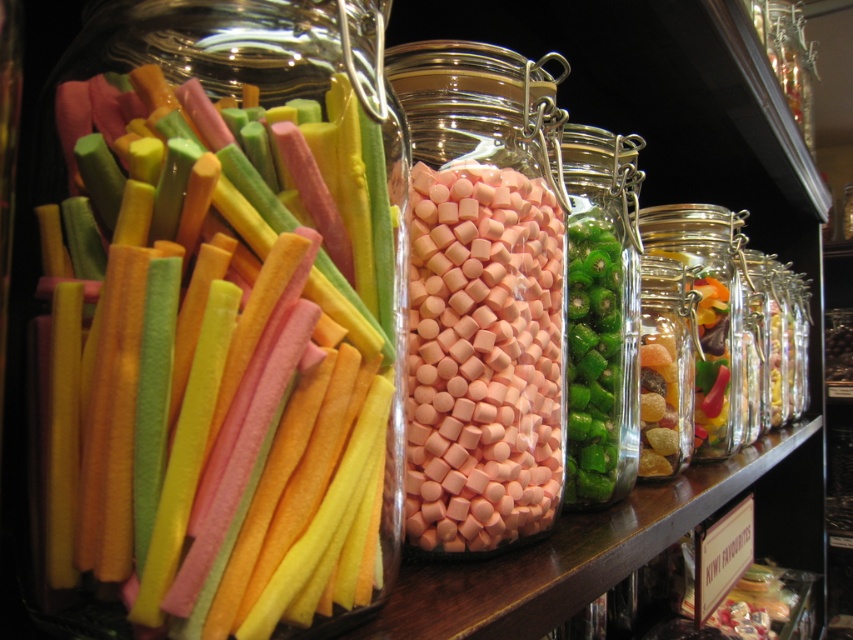
Does pink matte marshmallows at center have a smaller size compared to green glossy kiwi at center?

Correct, pink matte marshmallows at center occupies less space than green glossy kiwi at center.

Does pink matte marshmallows at center appear on the right side of green glossy kiwi at center?

No, pink matte marshmallows at center is not to the right of green glossy kiwi at center.

Who is more distant from viewer, (547, 492) or (637, 285)?

The point (637, 285) is behind.

This screenshot has height=640, width=853. I want to click on pink matte marshmallows at center, so pos(482,356).

Is the position of soft candy sticks at left more distant than that of translucent glass candy at right?

No, it is not.

Is soft candy sticks at left taller than translucent glass candy at right?

Correct, soft candy sticks at left is much taller as translucent glass candy at right.

Image resolution: width=853 pixels, height=640 pixels. What do you see at coordinates (216, 365) in the screenshot? I see `soft candy sticks at left` at bounding box center [216, 365].

The image size is (853, 640). I want to click on soft candy sticks at left, so click(x=216, y=365).

Does green glossy kiwi at center have a greater height compared to translucent glass candy at right?

Correct, green glossy kiwi at center is much taller as translucent glass candy at right.

Who is more forward, (601, 348) or (643, 317)?

Point (601, 348) is more forward.

Does point (636, 419) come closer to viewer compared to point (666, 284)?

Yes, it is.

Identify the location of green glossy kiwi at center. tap(601, 314).